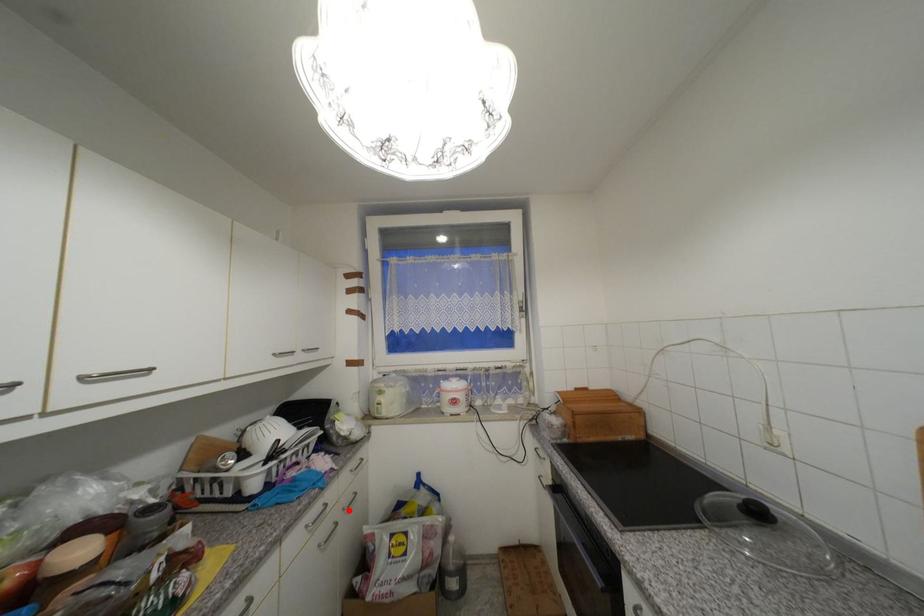
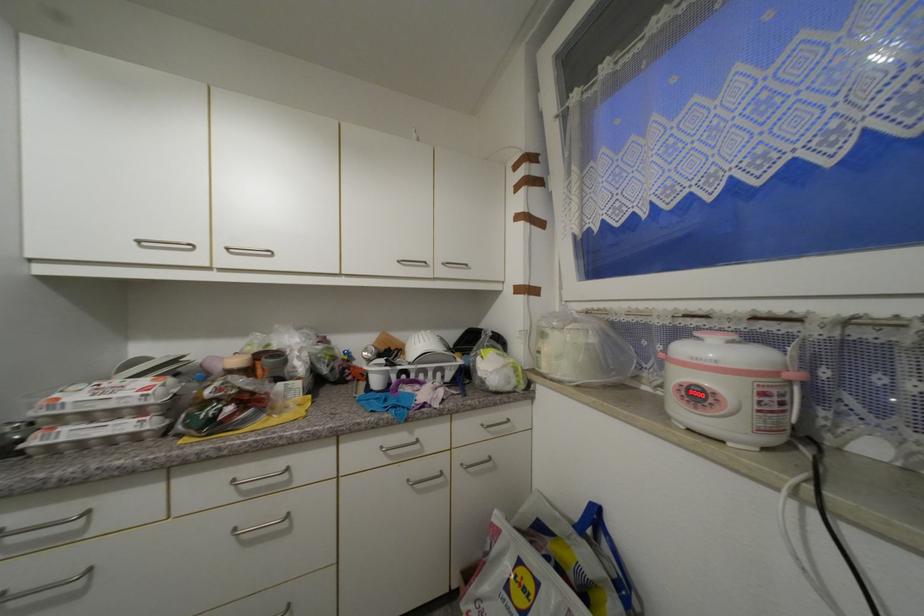
Question: I am providing you with two images of the same scene from different viewpoints. Given a red point in image1, look at the same physical point in image2. Is it:

Choices:
 (A) Closer to the viewpoint
 (B) Farther from the viewpoint

Answer: (B)